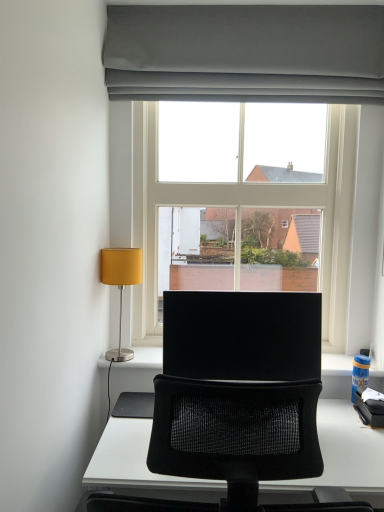
This screenshot has width=384, height=512. What are the coordinates of `free space above matte gray curtain at upper center (from a real-world perspective)` in the screenshot? It's located at (248, 3).